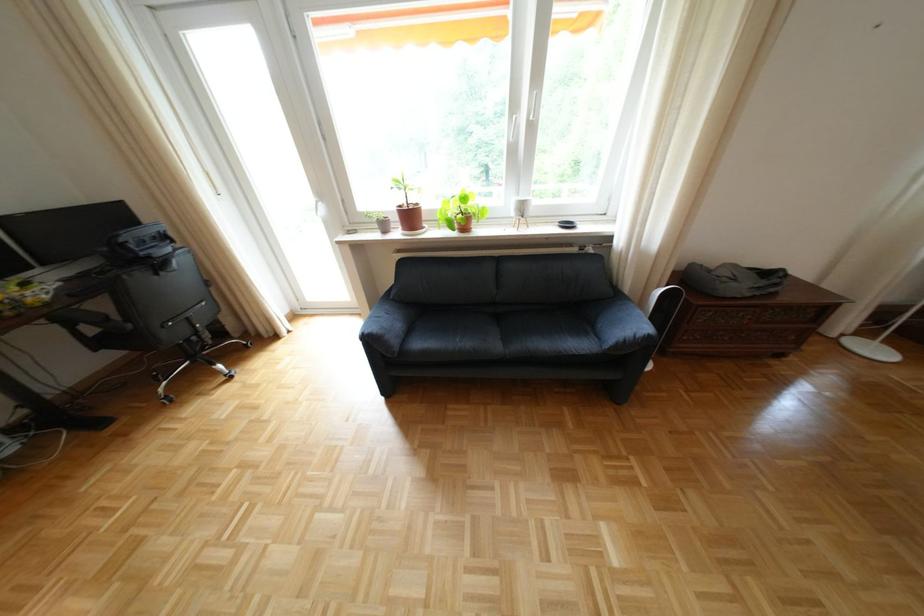
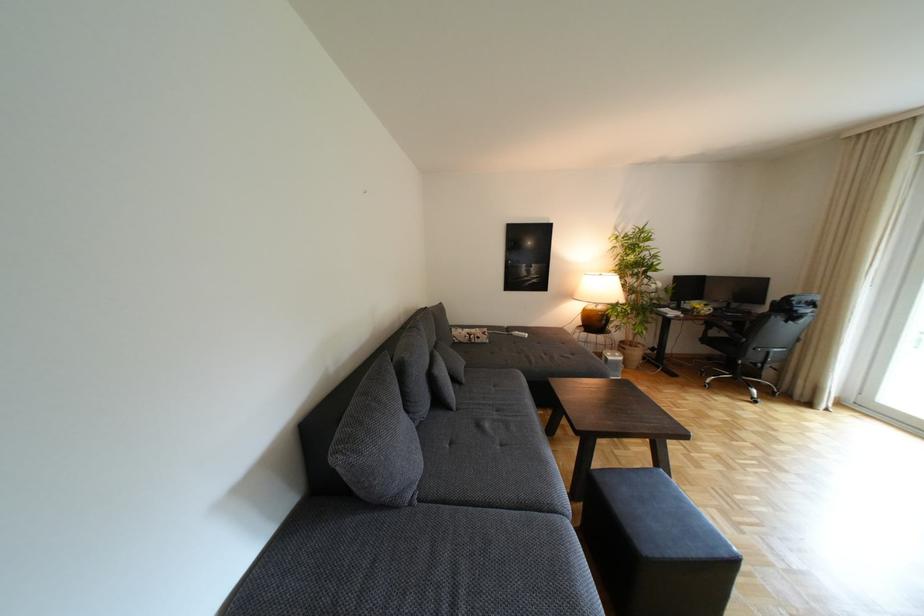
Find the pixel in the second image that matches point 55,322 in the first image.

(715, 322)